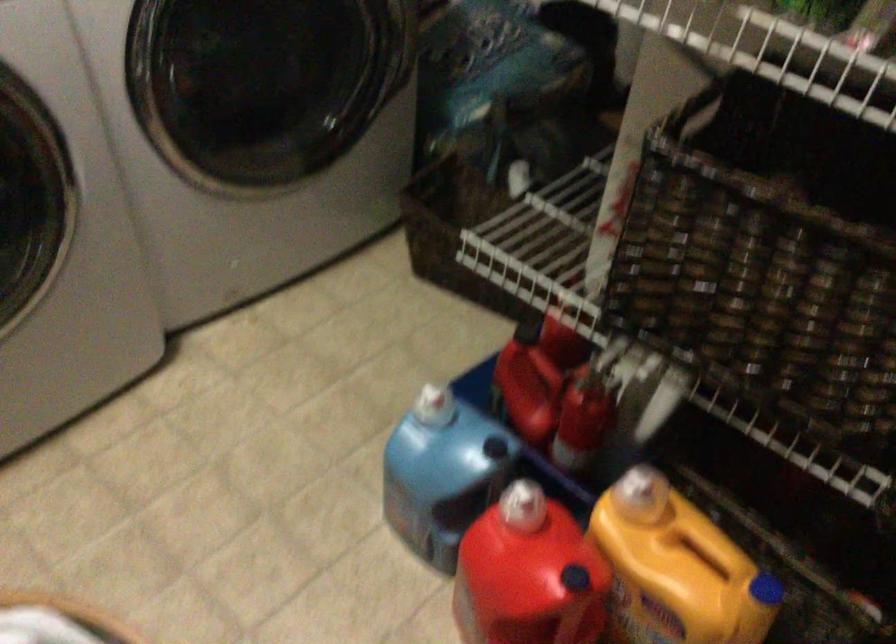
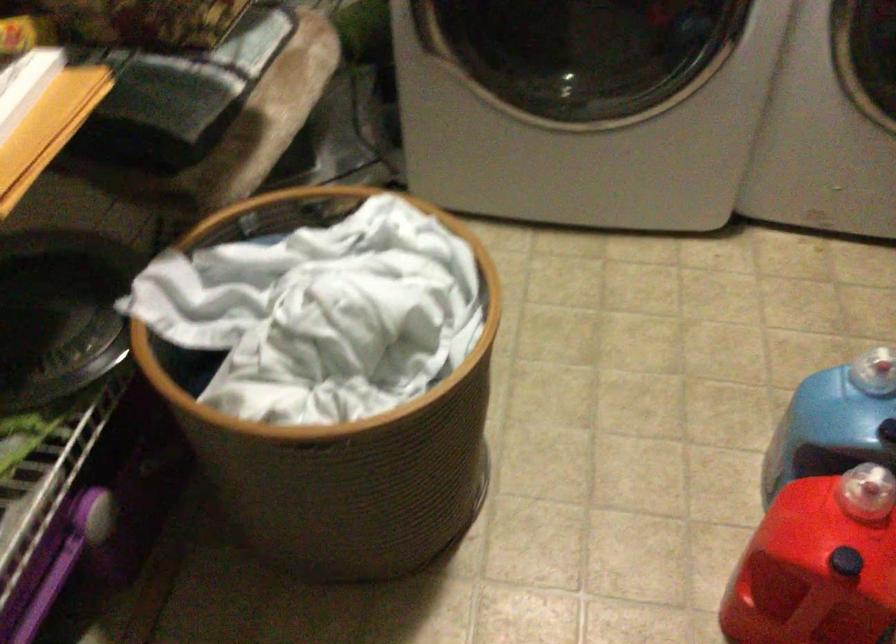
Based on the continuous images, in which direction is the camera rotating?

The camera rotated toward left-down.